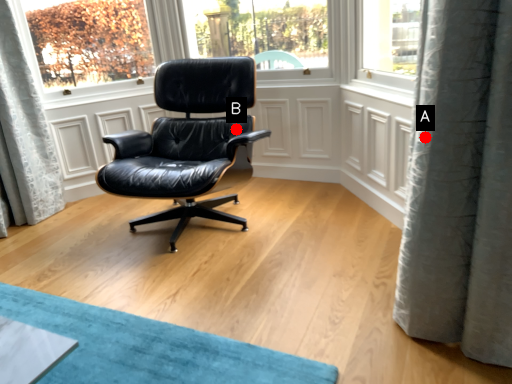
Question: Two points are circled on the image, labeled by A and B beside each circle. Which point is farther to the camera?

Choices:
 (A) A is further
 (B) B is further

Answer: (B)